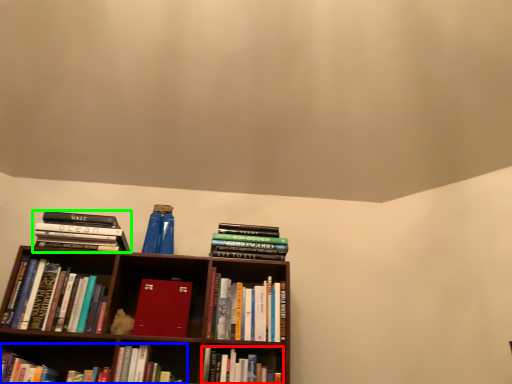
Question: Which object is positioned farthest from book (highlighted by a red box)? Select from book (highlighted by a blue box) and book (highlighted by a green box).

Choices:
 (A) book
 (B) book

Answer: (B)